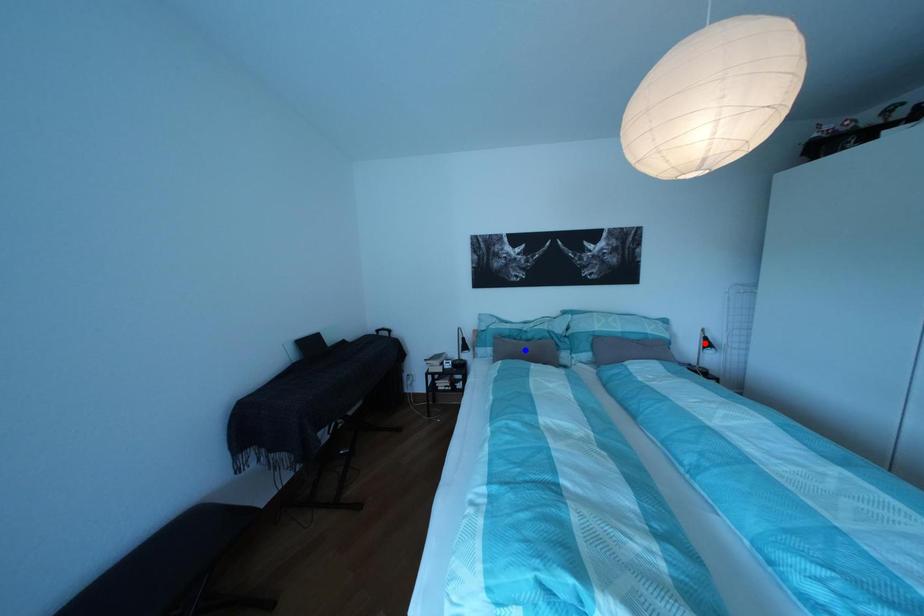
Question: Two points are marked on the image. Which point is closer to the camera?

Choices:
 (A) Blue point is closer.
 (B) Red point is closer.

Answer: (B)